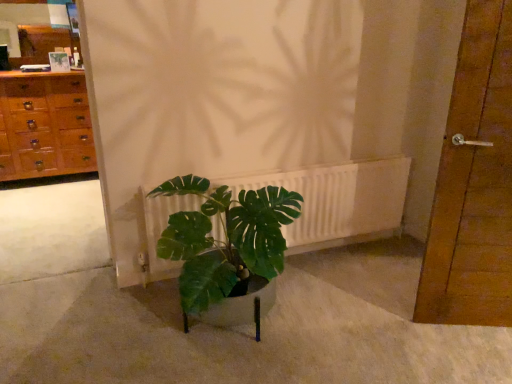
Question: Is white matte radiator at center completely or partially inside matte wooden mirror at upper left?

Choices:
 (A) yes
 (B) no

Answer: (B)

Question: Is white matte radiator at center at the back of matte wooden mirror at upper left?

Choices:
 (A) no
 (B) yes

Answer: (A)

Question: Is matte wooden mirror at upper left completely or partially outside of white matte radiator at center?

Choices:
 (A) no
 (B) yes

Answer: (B)

Question: Considering the relative positions of matte wooden mirror at upper left and white matte radiator at center in the image provided, is matte wooden mirror at upper left in front of white matte radiator at center?

Choices:
 (A) yes
 (B) no

Answer: (B)

Question: Can you confirm if matte wooden mirror at upper left is smaller than white matte radiator at center?

Choices:
 (A) yes
 (B) no

Answer: (A)

Question: Is matte wooden mirror at upper left facing towards white matte radiator at center?

Choices:
 (A) yes
 (B) no

Answer: (B)

Question: Does brown wooden door at right have a greater height compared to matte wooden mirror at upper left?

Choices:
 (A) yes
 (B) no

Answer: (A)

Question: From the image's perspective, is brown wooden door at right beneath matte wooden mirror at upper left?

Choices:
 (A) yes
 (B) no

Answer: (A)

Question: From a real-world perspective, is brown wooden door at right positioned under matte wooden mirror at upper left based on gravity?

Choices:
 (A) yes
 (B) no

Answer: (A)

Question: Is brown wooden door at right turned away from matte wooden mirror at upper left?

Choices:
 (A) yes
 (B) no

Answer: (B)

Question: Can we say brown wooden door at right lies outside matte wooden mirror at upper left?

Choices:
 (A) yes
 (B) no

Answer: (A)

Question: Is brown wooden door at right next to matte wooden mirror at upper left?

Choices:
 (A) yes
 (B) no

Answer: (B)

Question: Can you confirm if white matte radiator at center is smaller than matte wooden mirror at upper left?

Choices:
 (A) yes
 (B) no

Answer: (B)